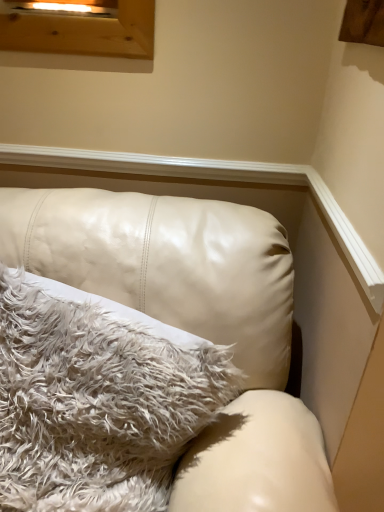
This screenshot has width=384, height=512. Describe the element at coordinates (193, 322) in the screenshot. I see `white leather couch at center` at that location.

At what (x,y) coordinates should I click in order to perform the action: click on white leather couch at center. Please return your answer as a coordinate pair (x, y). Looking at the image, I should click on (193, 322).

You are a GUI agent. You are given a task and a screenshot of the screen. Output one action in this format:
    pyautogui.click(x=<x>, y=<y>)
    Task: Click on the white leather couch at center
    Image resolution: width=384 pixels, height=512 pixels.
    Given the screenshot: What is the action you would take?
    pyautogui.click(x=193, y=322)